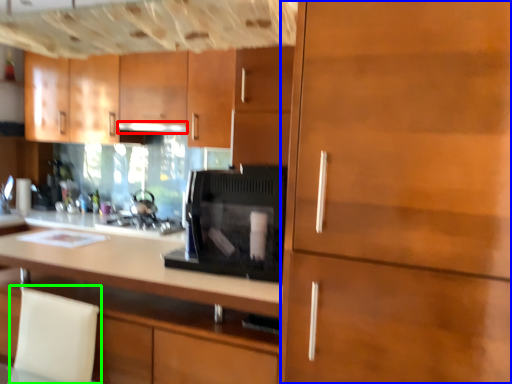
Question: Which object is the closest to the exhaust hood (highlighted by a red box)? Choose among these: cabinetry (highlighted by a blue box) or swivel chair (highlighted by a green box).

Choices:
 (A) cabinetry
 (B) swivel chair

Answer: (B)